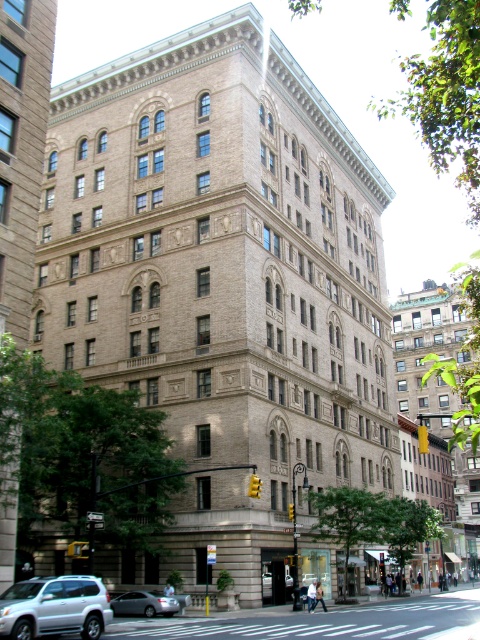
You are standing on the sidewalk in front of the building and notice two points marked on the facade. The first point is at coordinates point (62, 598) and the second is at point (180, 608). Which of these two points is closer to your current position?

Point (62, 598) is closer to the viewer than point (180, 608).

You are a delivery driver who needs to park your vehicle in a spot that requires clearance under a low bridge ahead. The maximum allowed height is 2 meters. You observe the silver metallic suv at lower left and the silver metallic sedan at lower center in the scene. Which vehicle would you choose to drive under the bridge without hitting the clearance limit?

The silver metallic suv at lower left is not as tall as the silver metallic sedan at lower center, so you should choose the silver metallic suv at lower left to drive under the bridge since it is shorter and less likely to hit the clearance limit.